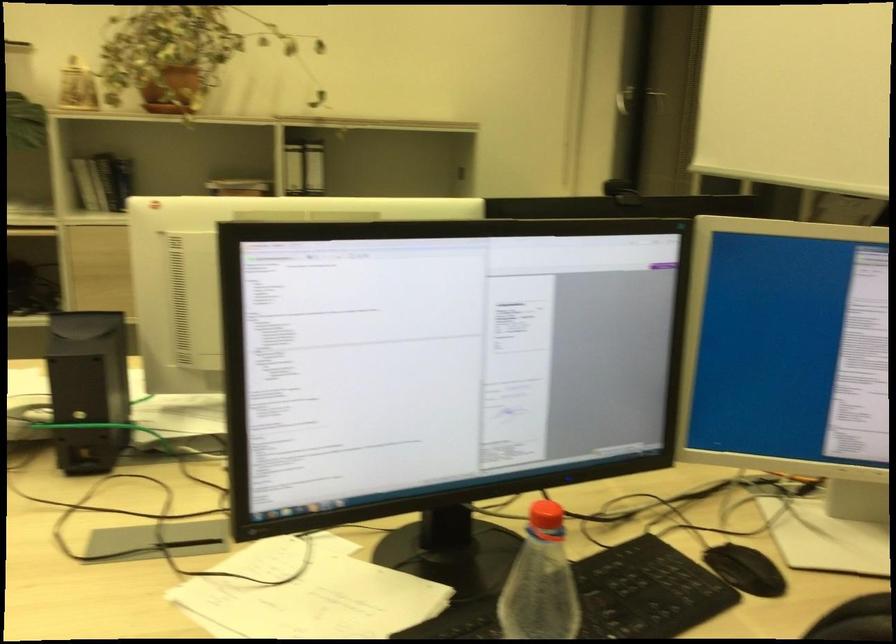
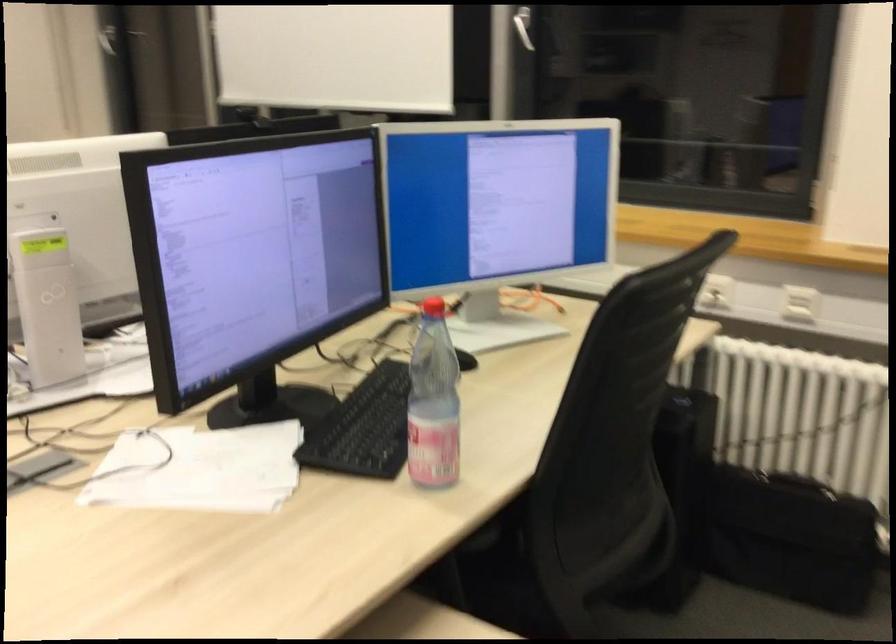
Find the pixel in the second image that matches (x=623, y=99) in the first image.

(112, 33)